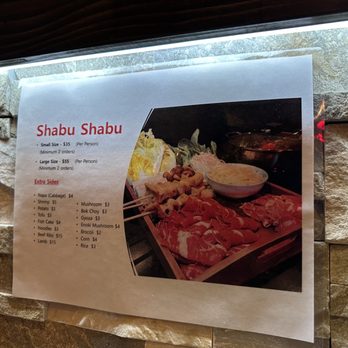
Where is `wall`? The height and width of the screenshot is (348, 348). wall is located at coordinates click(x=339, y=51).